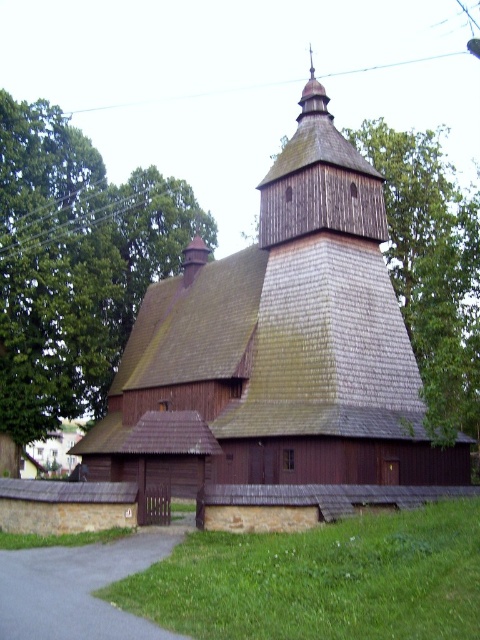
You are standing in front of the brown wooden tree at upper left and want to walk to the brown wooden church at center. Which direction should you face to move towards the church?

The brown wooden church at center is positioned on the right side of brown wooden tree at upper left, so you should face to the right to move towards the church.

You are standing at the entrance of the churchyard and want to find the brown wooden church at center. According to the coordinates provided, where should you look to locate it?

The brown wooden church at center is located at coordinates point (280, 360), so you should look towards the center of the image slightly towards the right and lower middle area.